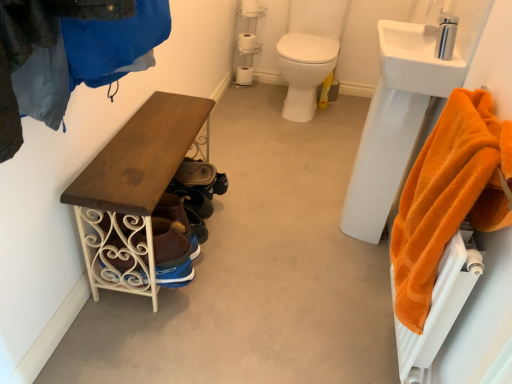
Image resolution: width=512 pixels, height=384 pixels. In order to click on vacant area that is situated to the right of white matte toilet paper at center, the 3th toilet paper viewed from the top in this screenshot , I will do `click(265, 81)`.